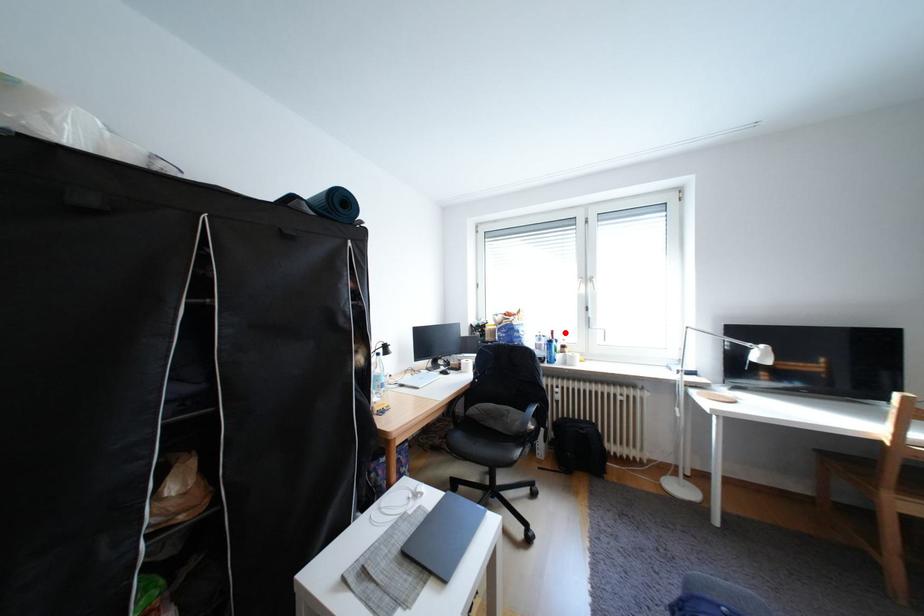
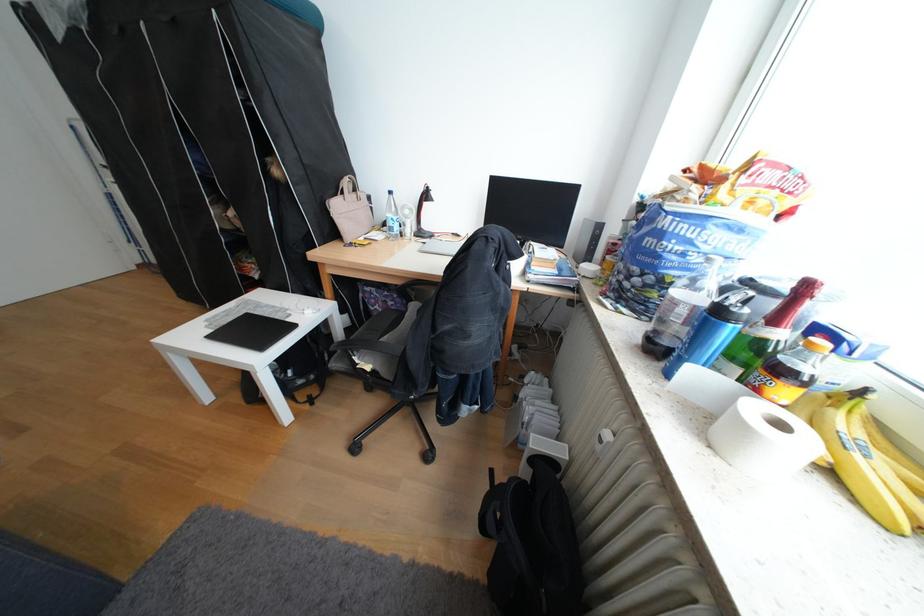
Where in the second image is the point corresponding to the highlighted location from the first image?

(819, 288)